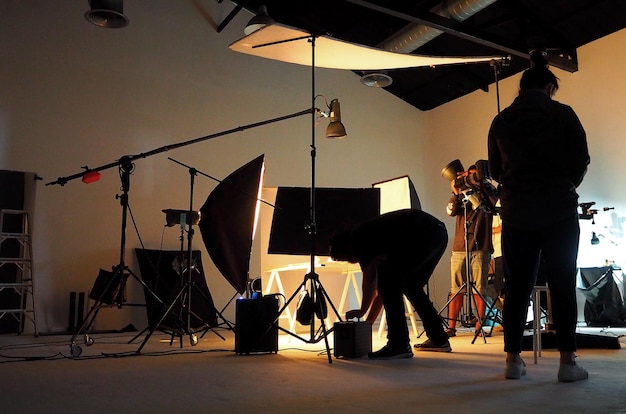
Where is `black ceiling`? This screenshot has width=626, height=414. black ceiling is located at coordinates (419, 81).